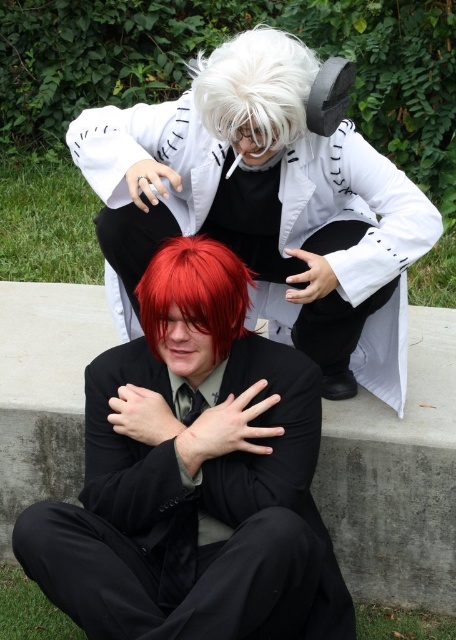
You are an observer standing in front of the scene. You see the shiny black suit at center and the white matte coat at upper center. Which object is positioned higher in the image?

The white matte coat at upper center is positioned higher in the image than the shiny black suit at center.

You are a photographer setting up for a photoshoot. You have a camera with a 1.5 meter wide lens. You need to position the camera so that both the white matte coat at upper center and the shiny red wig at center are fully visible in the frame. Can the camera capture both objects without moving the camera or the subjects?

The white matte coat at upper center might be wider than the shiny red wig at center, so it depends on the exact width of the coat. If the coat is wider than 1.5 meters, the camera lens might not capture both objects fully. However, if the coat is within the 1.5 meter width, then both can be captured.